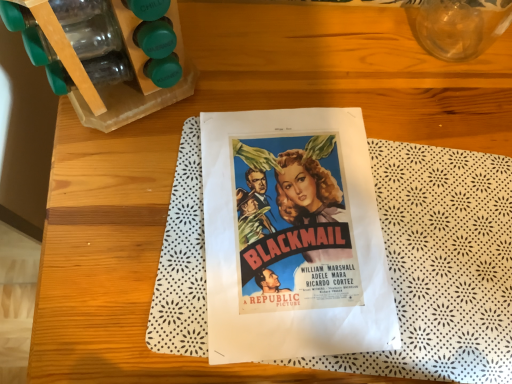
This screenshot has height=384, width=512. Find the location of `free space behind vivid paper poster at center`. free space behind vivid paper poster at center is located at coordinates (344, 81).